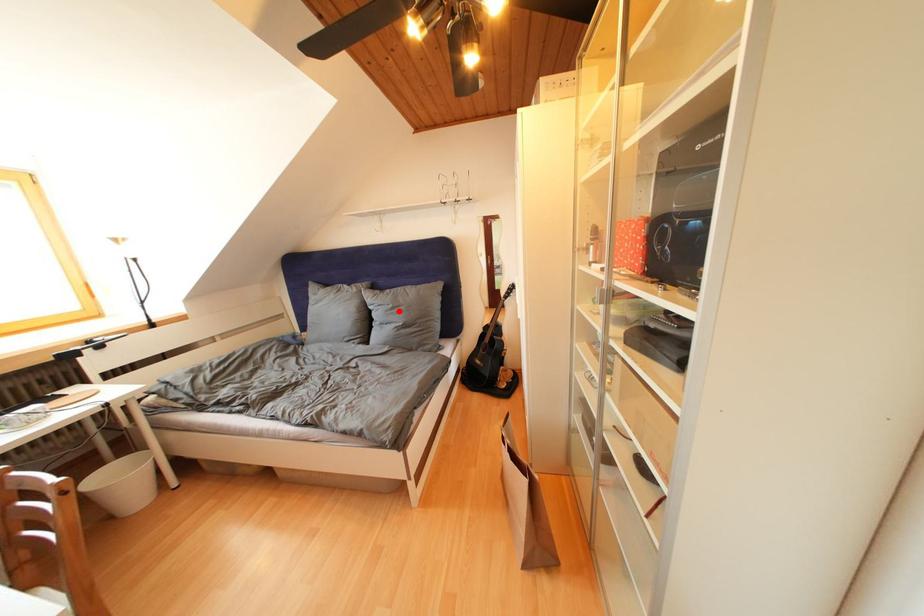
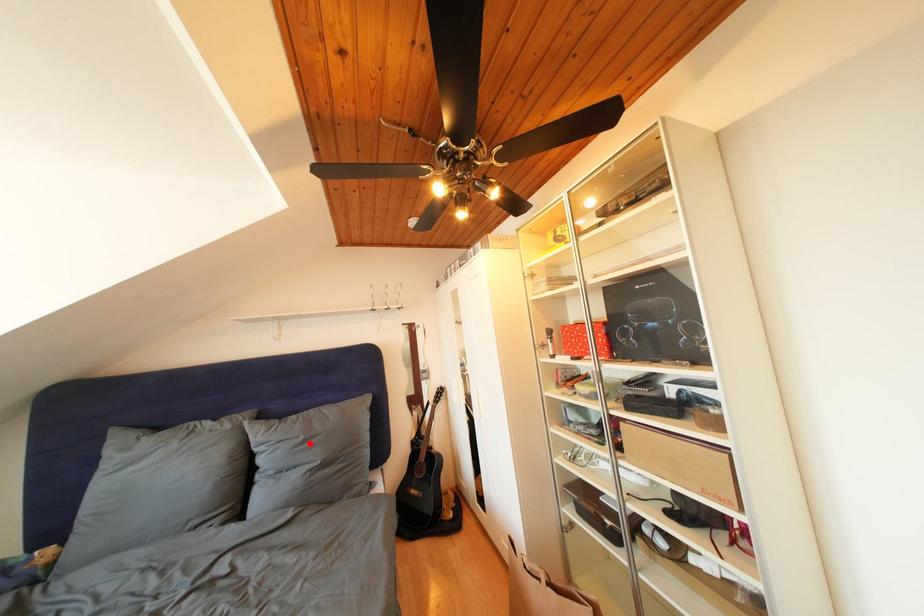
I am providing you with two images of the same scene from different viewpoints. A red point is marked on the first image and another point is marked on the second image. Does the point marked in image1 correspond to the same location as the one in image2?

Yes